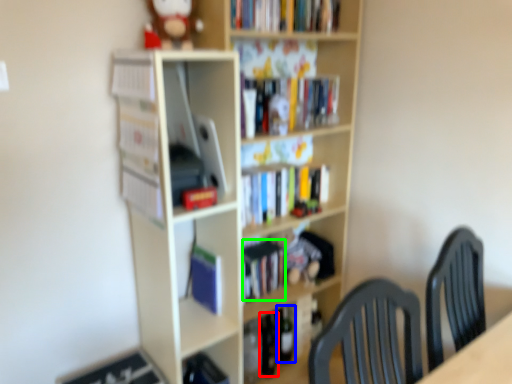
Question: Which is farther away from wine bottle (highlighted by a red box)? wine bottle (highlighted by a blue box) or book (highlighted by a green box)?

Choices:
 (A) wine bottle
 (B) book

Answer: (B)